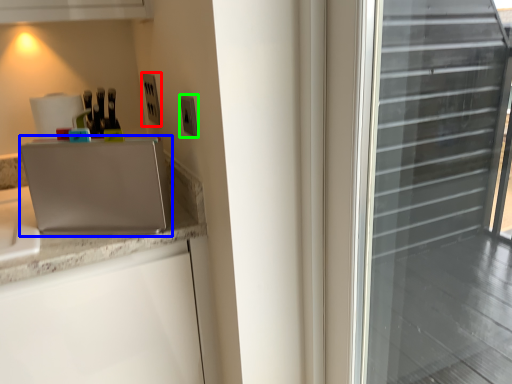
Question: Which object is positioned closest to electric outlet (highlighted by a red box)? Select from appliance (highlighted by a blue box) and electric outlet (highlighted by a green box).

Choices:
 (A) appliance
 (B) electric outlet

Answer: (B)